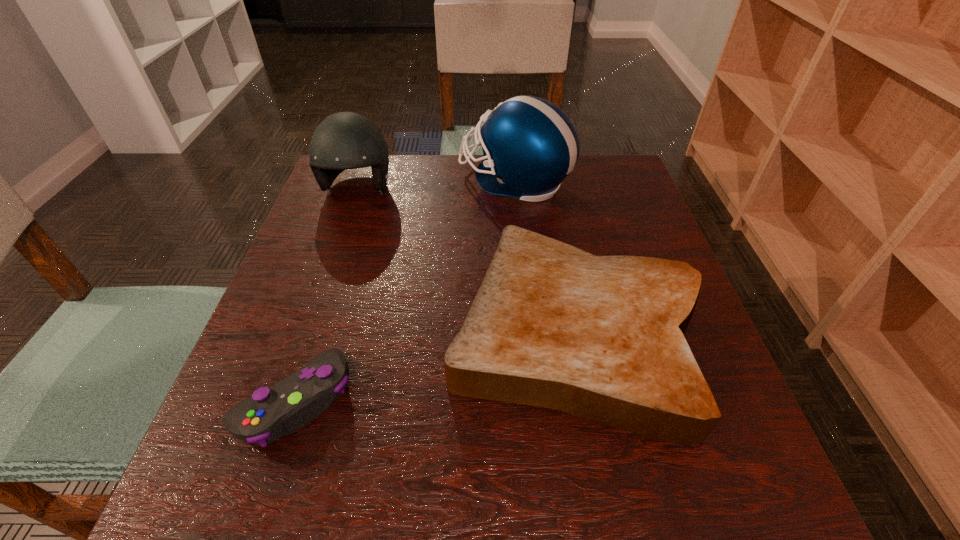
Identify the location of object that is the third nearest to the left football helmet. The image size is (960, 540). (287, 406).

The height and width of the screenshot is (540, 960). I want to click on vacant region that satisfies the following two spatial constraints: 1. on the back side of the bread; 2. at the front of the right football helmet with the faceguard, so click(546, 181).

The width and height of the screenshot is (960, 540). I want to click on vacant area in the image that satisfies the following two spatial constraints: 1. on the back side of the control; 2. on the right side of the bread, so click(317, 332).

Where is `vacant space that satisfies the following two spatial constraints: 1. at the front of the right football helmet with the faceguard; 2. on the left side of the bread`? This screenshot has width=960, height=540. vacant space that satisfies the following two spatial constraints: 1. at the front of the right football helmet with the faceguard; 2. on the left side of the bread is located at coordinates (529, 332).

What are the coordinates of `free location that satisfies the following two spatial constraints: 1. at the front of the bread with the faceguard; 2. on the left side of the right football helmet` in the screenshot? It's located at (529, 332).